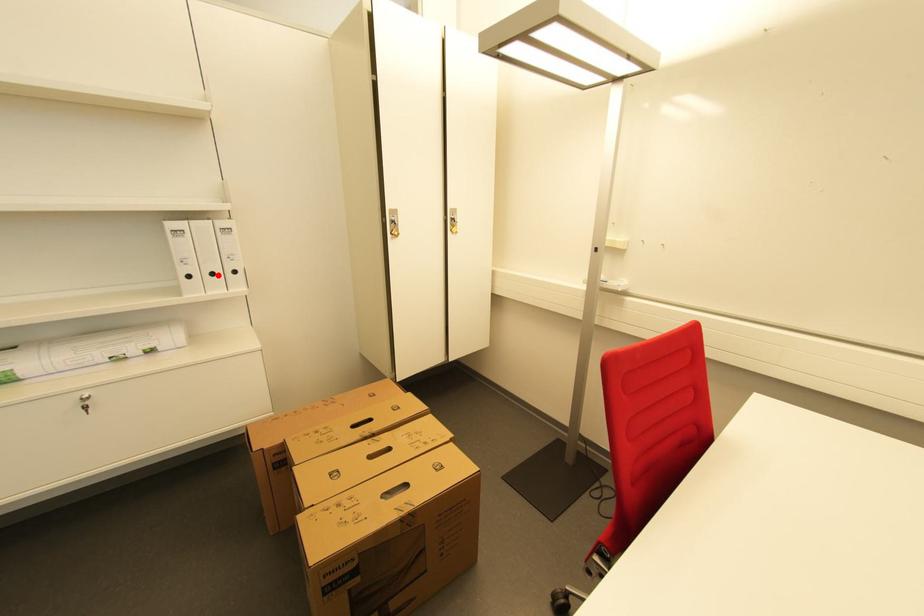
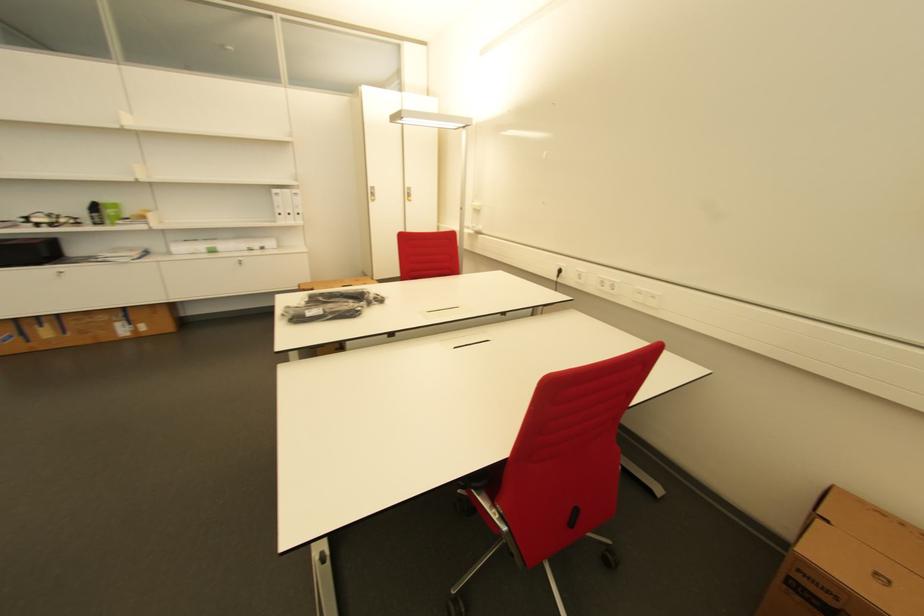
Where in the second image is the point corresponding to the highlighted location from the first image?

(294, 216)